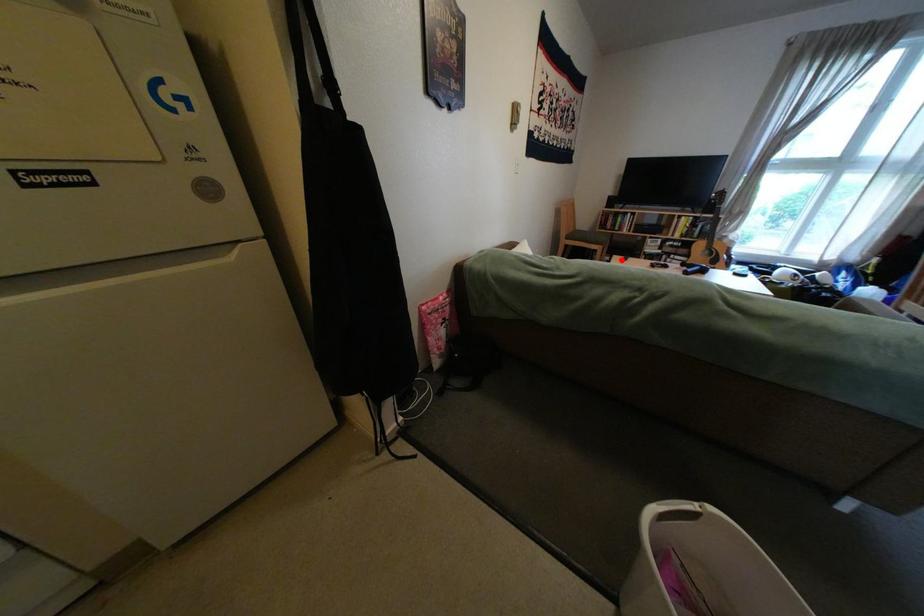
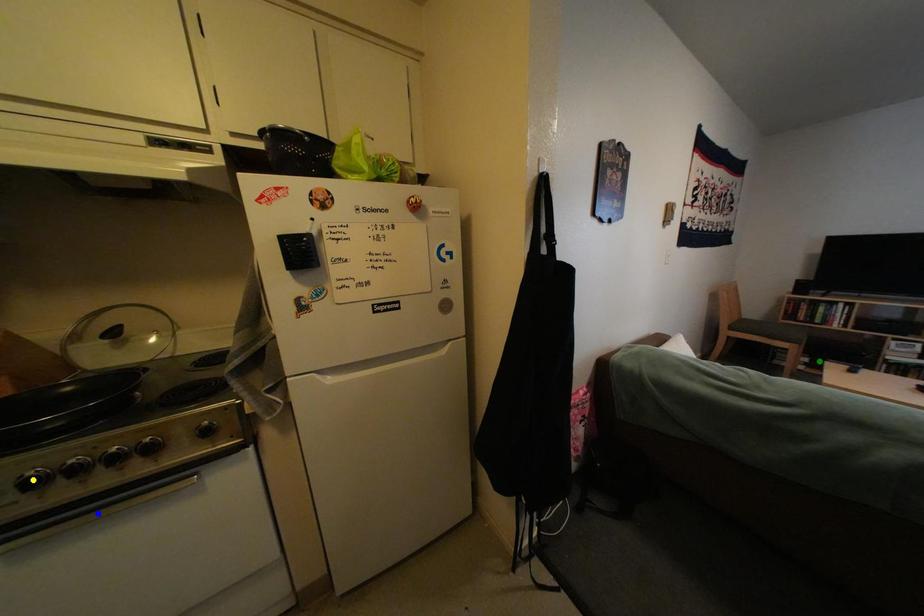
Question: I am providing you with two images of the same scene from different viewpoints. A red point is marked on the first image. You are given multiple points on the second image. Which point in image 2 represents the same 3d spot as the red point in image 1?

Choices:
 (A) yellow point
 (B) green point
 (C) blue point

Answer: (B)